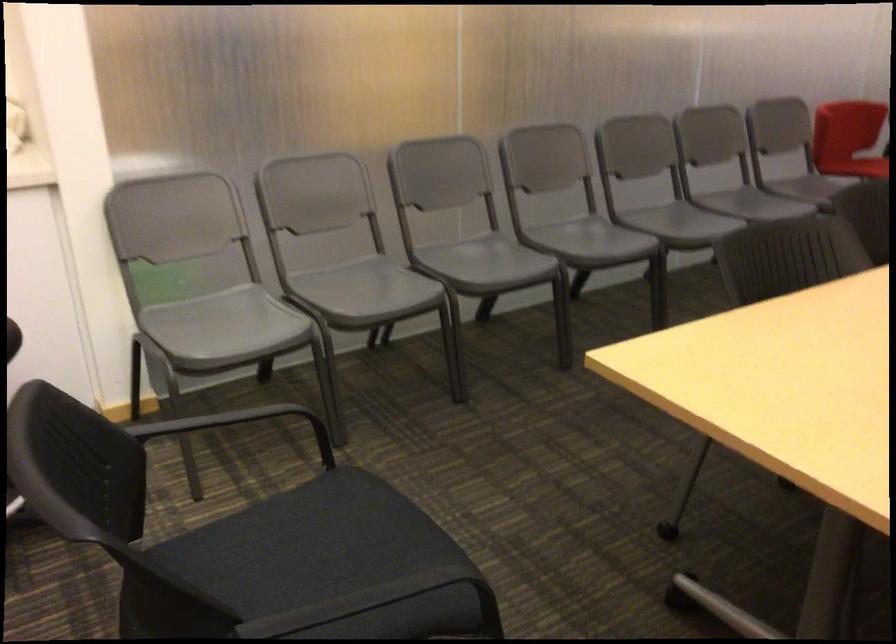
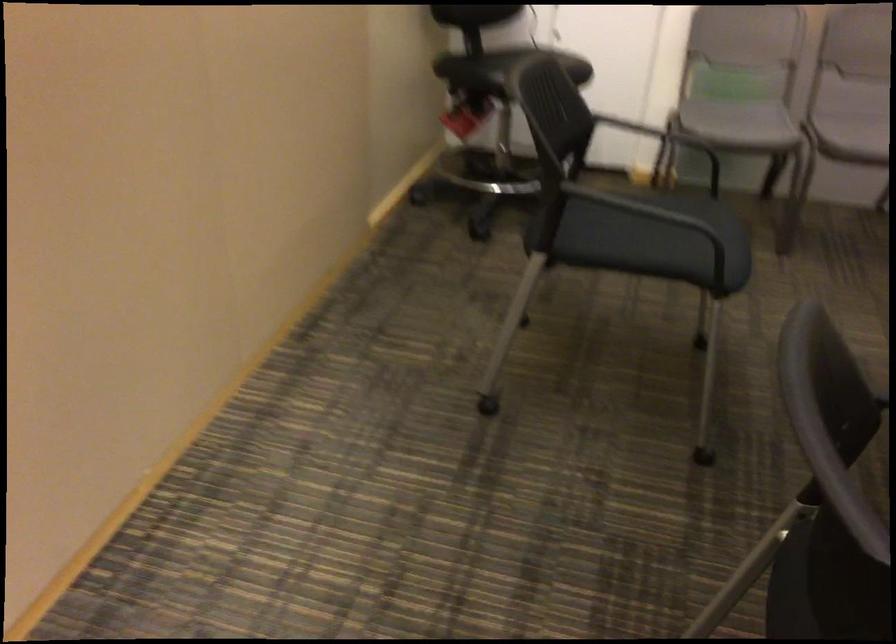
The point at [300,569] is marked in the first image. Where is the corresponding point in the second image?

(657, 222)